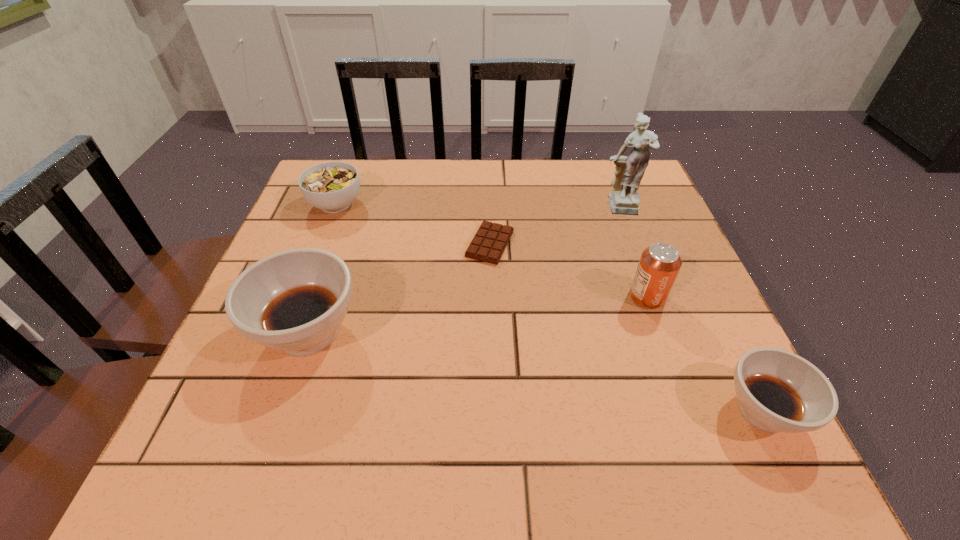
This screenshot has height=540, width=960. Identify the location of object located at the far right corner. (624, 199).

You are a GUI agent. You are given a task and a screenshot of the screen. Output one action in this format:
    pyautogui.click(x=<x>, y=<y>)
    Task: Click on the object at the near right corner
    
    Given the screenshot: What is the action you would take?
    pyautogui.click(x=778, y=391)

At what (x,y) coordinates should I click in order to perform the action: click on free location at the far edge. Please return your answer as a coordinate pair (x, y). The image size is (960, 540). Looking at the image, I should click on (469, 184).

This screenshot has width=960, height=540. I want to click on vacant space at the near edge of the desktop, so click(629, 377).

In the image, there is a desktop. Identify the location of free region at the left edge. click(344, 230).

This screenshot has width=960, height=540. I want to click on free space at the right edge of the desktop, so click(x=674, y=303).

In the image, there is a desktop. In order to click on vacant area at the near left corner in this screenshot , I will do `click(246, 370)`.

Find the location of `vacant space at the far right corner of the desktop`. vacant space at the far right corner of the desktop is located at coordinates 598,203.

The height and width of the screenshot is (540, 960). In order to click on blank area at the near right corner in this screenshot , I will do `click(732, 415)`.

This screenshot has height=540, width=960. I want to click on free space between the rightmost soup bowl and the can, so click(x=705, y=354).